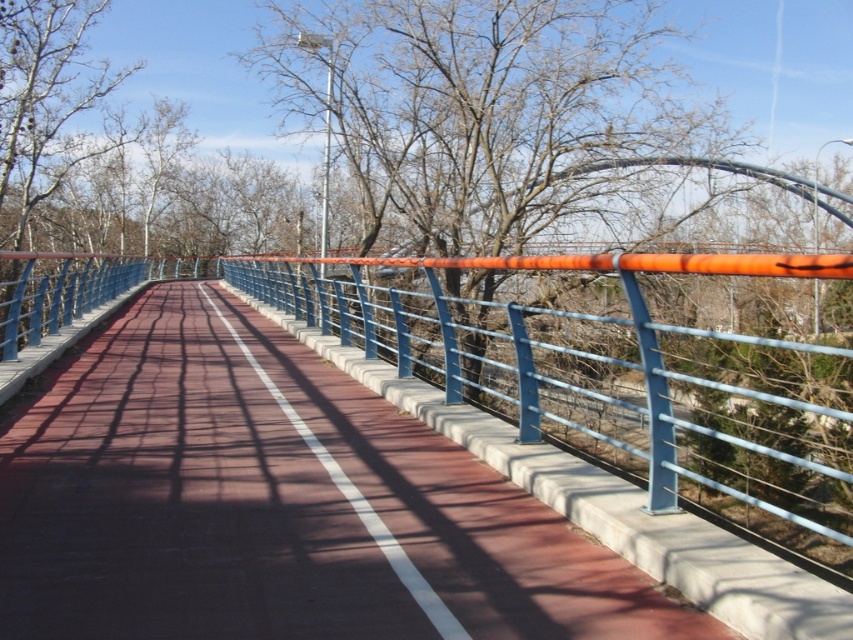
Question: Which object is farther from the camera taking this photo?

Choices:
 (A) smooth concrete path at center
 (B) bare branches at upper center

Answer: (B)

Question: Is smooth concrete path at center positioned behind bare branches at upper center?

Choices:
 (A) no
 (B) yes

Answer: (A)

Question: Can you confirm if smooth concrete path at center is positioned below bare branches at upper center?

Choices:
 (A) no
 (B) yes

Answer: (B)

Question: Does smooth concrete path at center appear over bare branches at upper center?

Choices:
 (A) yes
 (B) no

Answer: (B)